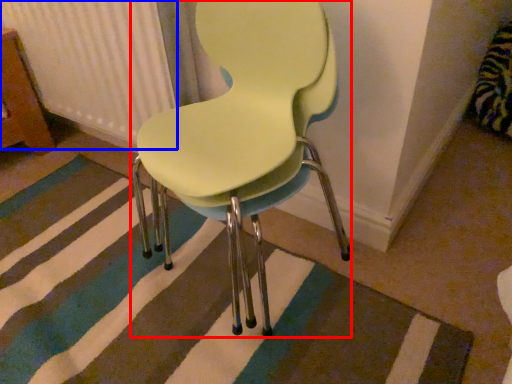
Question: Which of the following is the closest to the observer, chair (highlighted by a red box) or radiator (highlighted by a blue box)?

Choices:
 (A) chair
 (B) radiator

Answer: (A)